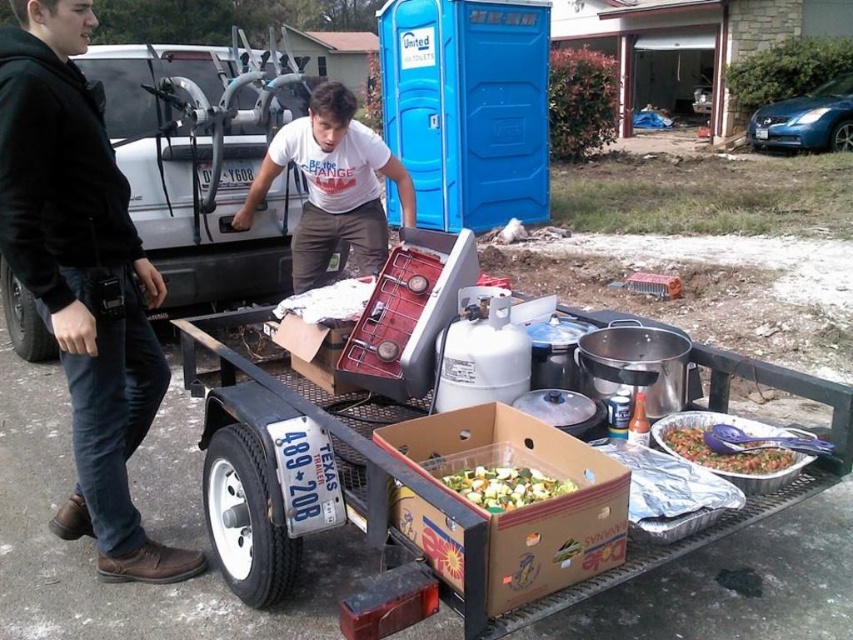
Who is shorter, white cotton t-shirt at center or green leafy vegetables at center?

green leafy vegetables at center

Is white cotton t-shirt at center bigger than green leafy vegetables at center?

Indeed, white cotton t-shirt at center has a larger size compared to green leafy vegetables at center.

At what (x,y) coordinates should I click in order to perform the action: click on white cotton t-shirt at center. Please return your answer as a coordinate pair (x, y). This screenshot has height=640, width=853. Looking at the image, I should click on (x=332, y=186).

Which of these two, brown cardboard box at center or white cardboard box at center, stands taller?

Standing taller between the two is brown cardboard box at center.

Who is more forward, (573, 493) or (350, 278)?

Positioned in front is point (573, 493).

The height and width of the screenshot is (640, 853). I want to click on brown cardboard box at center, so click(527, 504).

Consider the image. Is tomato salsa in aluminum pan at lower right wider than white cardboard box at center?

No.

Is tomato salsa in aluminum pan at lower right smaller than white cardboard box at center?

Indeed, tomato salsa in aluminum pan at lower right has a smaller size compared to white cardboard box at center.

The image size is (853, 640). Identify the location of tomato salsa in aluminum pan at lower right. (723, 452).

Find the location of a particular element. Image resolution: width=853 pixels, height=640 pixels. tomato salsa in aluminum pan at lower right is located at coordinates (723, 452).